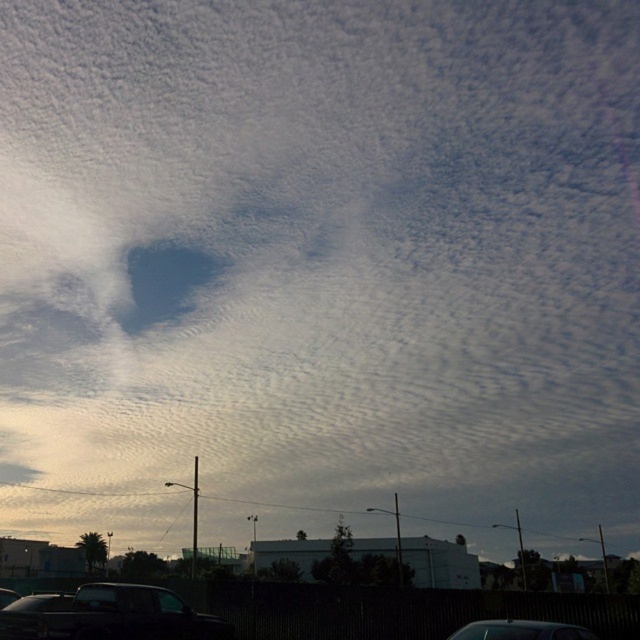
From the picture: Who is taller, dark gray metallic car at lower left or shiny black car at bottom?

dark gray metallic car at lower left is taller.

Measure the distance between dark gray metallic car at lower left and camera.

dark gray metallic car at lower left and camera are 41.50 feet apart.

Does point (74, 598) come in front of point (525, 620)?

No, it is behind (525, 620).

In order to click on dark gray metallic car at lower left in this screenshot , I will do `click(109, 616)`.